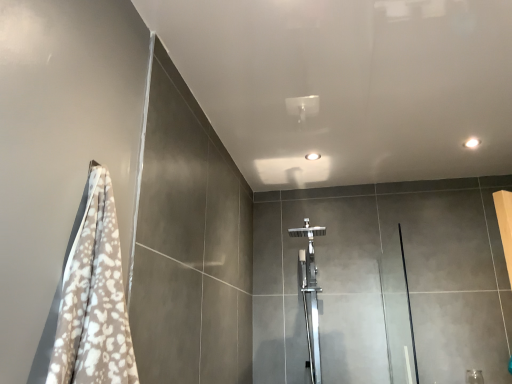
Question: Can you confirm if transparent glass screen door at right is positioned to the right of polished chrome shower at center?

Choices:
 (A) no
 (B) yes

Answer: (B)

Question: From a real-world perspective, is transparent glass screen door at right positioned over polished chrome shower at center based on gravity?

Choices:
 (A) no
 (B) yes

Answer: (A)

Question: Does transparent glass screen door at right appear on the left side of polished chrome shower at center?

Choices:
 (A) no
 (B) yes

Answer: (A)

Question: Considering the relative sizes of transparent glass screen door at right and polished chrome shower at center in the image provided, is transparent glass screen door at right smaller than polished chrome shower at center?

Choices:
 (A) yes
 (B) no

Answer: (A)

Question: Is transparent glass screen door at right surrounding polished chrome shower at center?

Choices:
 (A) no
 (B) yes

Answer: (A)

Question: Is transparent glass screen door at right facing towards polished chrome shower at center?

Choices:
 (A) yes
 (B) no

Answer: (B)

Question: Is polished chrome shower at center in contact with transparent glass screen door at right?

Choices:
 (A) yes
 (B) no

Answer: (B)

Question: Considering the relative sizes of polished chrome shower at center and transparent glass screen door at right in the image provided, is polished chrome shower at center smaller than transparent glass screen door at right?

Choices:
 (A) no
 (B) yes

Answer: (A)

Question: Is polished chrome shower at center closer to camera compared to transparent glass screen door at right?

Choices:
 (A) yes
 (B) no

Answer: (B)

Question: From the image's perspective, does polished chrome shower at center appear higher than transparent glass screen door at right?

Choices:
 (A) no
 (B) yes

Answer: (B)

Question: Is polished chrome shower at center completely or partially outside of transparent glass screen door at right?

Choices:
 (A) no
 (B) yes

Answer: (B)

Question: Can you confirm if polished chrome shower at center is taller than transparent glass screen door at right?

Choices:
 (A) no
 (B) yes

Answer: (B)

Question: Based on their positions, is transparent glass screen door at right located to the left or right of polished chrome shower at center?

Choices:
 (A) left
 (B) right

Answer: (B)